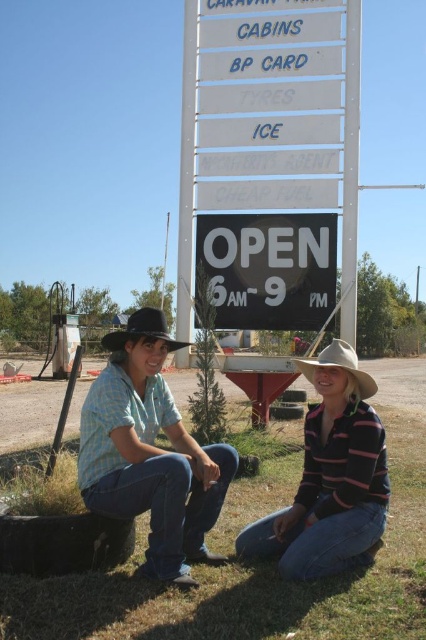
Question: Which object is positioned farthest from the white plastic signboard at center?

Choices:
 (A) striped cotton shirt at lower right
 (B) black matte cowboy hat at center
 (C) blue plaid shirt at center
 (D) green grass at lower center

Answer: (D)

Question: Is blue plaid shirt at center thinner than black plastic sign at center?

Choices:
 (A) yes
 (B) no

Answer: (A)

Question: Which point appears closest to the camera in this image?

Choices:
 (A) (206, 280)
 (B) (169, 349)

Answer: (B)

Question: Observing the image, what is the correct spatial positioning of light brown felt cowboy hat at lower right in reference to black matte cowboy hat at center?

Choices:
 (A) left
 (B) right

Answer: (B)

Question: Which object is farther from the camera taking this photo?

Choices:
 (A) green grass at lower center
 (B) black plastic sign at center
 (C) blue plaid shirt at center

Answer: (B)

Question: Is blue plaid shirt at center closer to the viewer compared to striped cotton shirt at lower right?

Choices:
 (A) yes
 (B) no

Answer: (A)